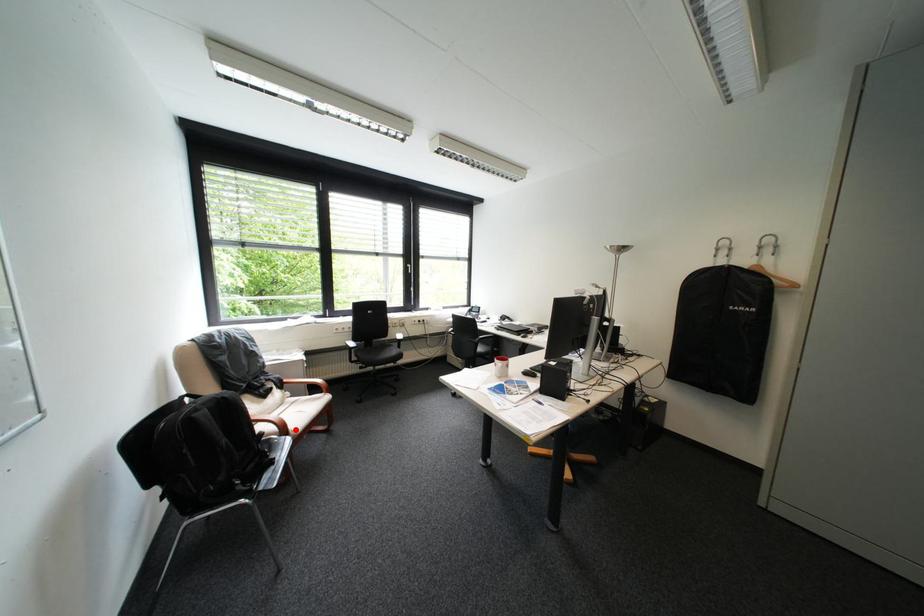
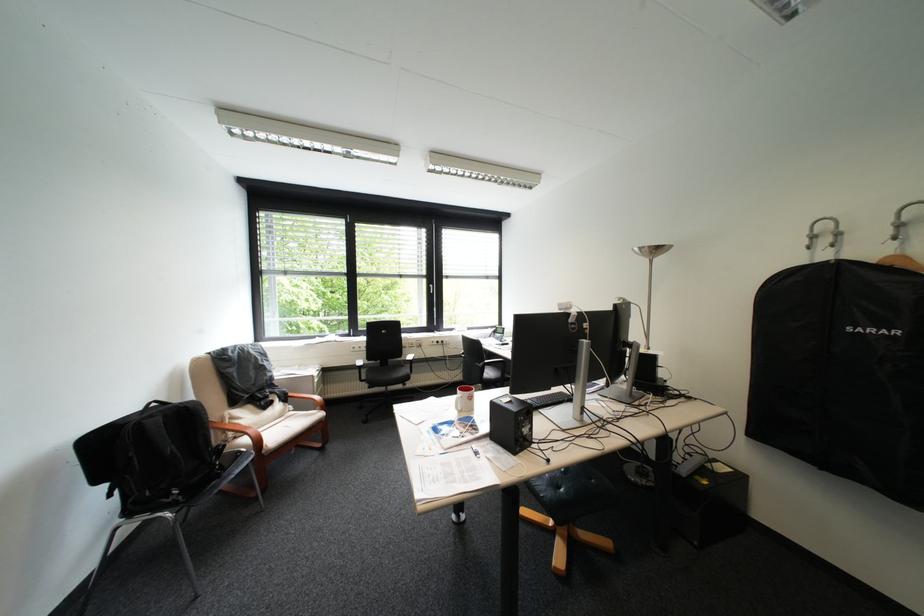
Find the pixel in the second image that matches the highlighted location in the first image.

(271, 443)